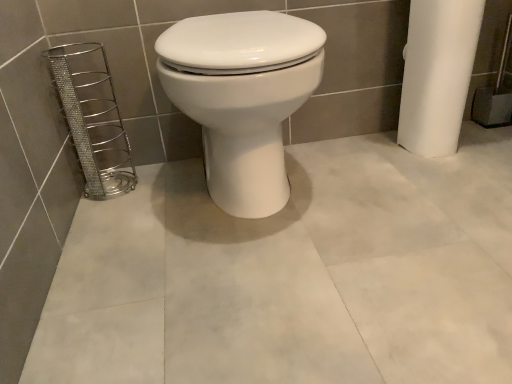
What are the coordinates of `free location in front of white glossy toilet at center` in the screenshot? It's located at (260, 294).